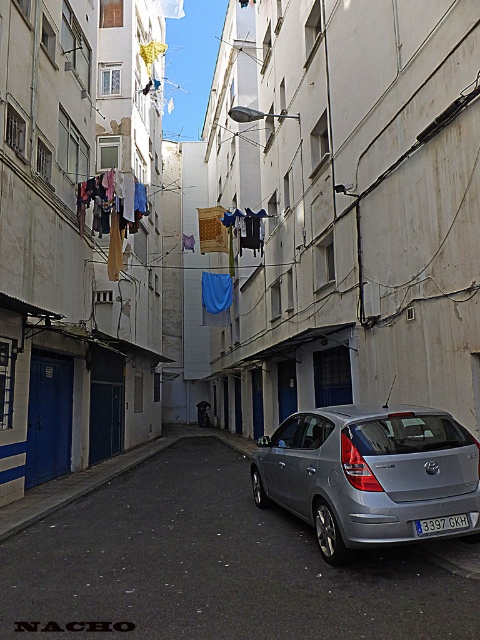
Question: Which of the following is the farthest from the observer?

Choices:
 (A) (264, 438)
 (B) (156, 464)
 (C) (468, 522)

Answer: (A)

Question: Which object is the closest to the silver metallic car at center?

Choices:
 (A) blue metallic license plate at center
 (B) satin silver hatchback at center

Answer: (B)

Question: Does silver metallic car at center appear on the left side of blue metallic license plate at center?

Choices:
 (A) no
 (B) yes

Answer: (B)

Question: Which object is closer to the camera taking this photo?

Choices:
 (A) satin silver hatchback at center
 (B) blue metallic license plate at center

Answer: (A)

Question: Is silver metallic car at center smaller than blue metallic license plate at center?

Choices:
 (A) no
 (B) yes

Answer: (A)

Question: Does silver metallic car at center lie in front of blue metallic license plate at center?

Choices:
 (A) no
 (B) yes

Answer: (B)